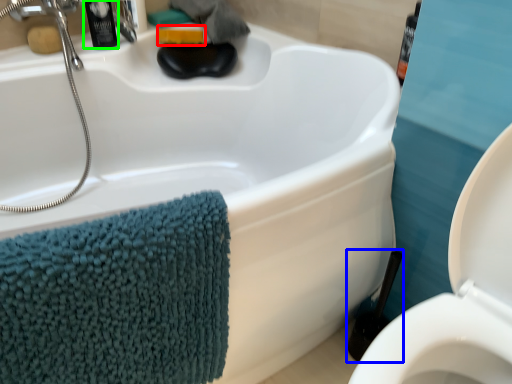
Question: Based on their relative distances, which object is nearer to soap (highlighted by a red box)? Choose from brush (highlighted by a blue box) and toiletry (highlighted by a green box).

Choices:
 (A) brush
 (B) toiletry

Answer: (B)